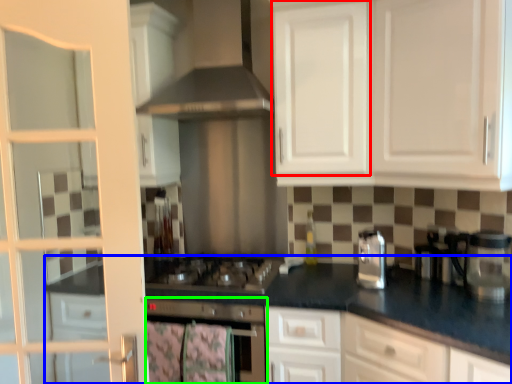
Question: Which object is positioned closest to cabinetry (highlighted by a red box)? Select from countertop (highlighted by a blue box) and home appliance (highlighted by a green box).

Choices:
 (A) countertop
 (B) home appliance

Answer: (A)